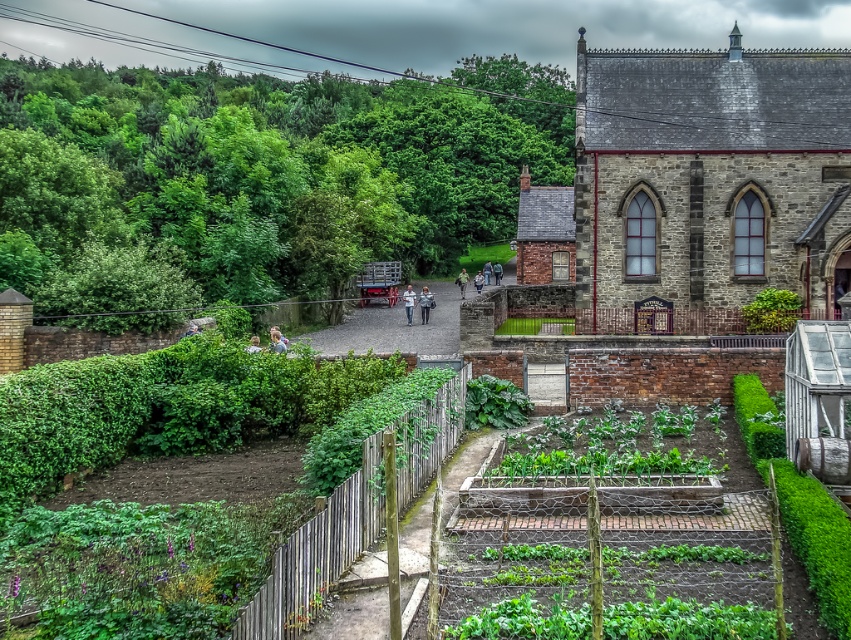
You are standing in the garden and want to take a photo of both the green leafy hedge at upper left and the gray stone church at upper right. Which direction should you face to ensure both are visible in your camera frame?

You should face towards the center of the garden between the green leafy hedge at upper left and the gray stone church at upper right so that both are visible in your camera frame since the green leafy hedge at upper left is to the left of gray stone church at upper right.

You are standing in the garden and want to take a photo of the gray stone church at upper right without the green wooden fence at lower center blocking the view. Is this possible?

The gray stone church at upper right is positioned over the green wooden fence at lower center, so the fence will block the view of the church unless you move to a higher vantage point.